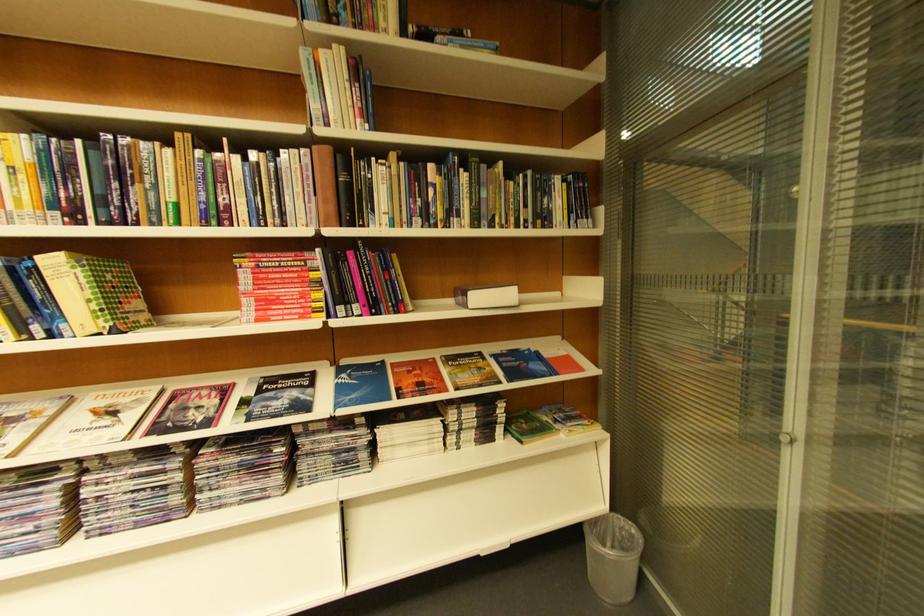
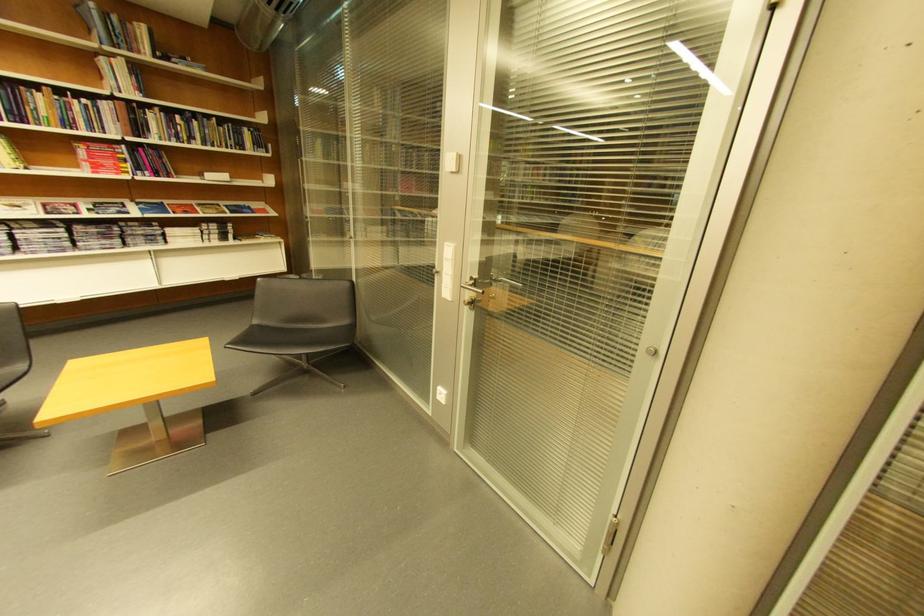
Where in the second image is the point corresponding to point 475,179 from the first image?

(205, 124)